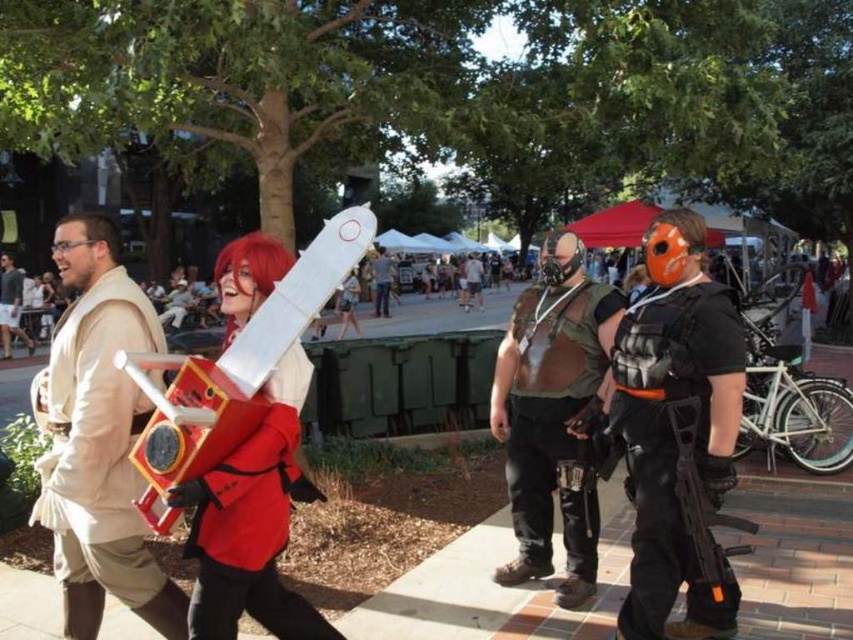
Is beige fabric coat at left further to camera compared to leather vest at center?

No, it is not.

From the picture: Does beige fabric coat at left lie in front of leather vest at center?

Yes.

Who is more forward, (x=132, y=476) or (x=553, y=342)?

Point (x=132, y=476) is more forward.

Locate an element on the screen. beige fabric coat at left is located at coordinates (97, 440).

Does beige fabric coat at left appear on the left side of matte black vest at center?

In fact, beige fabric coat at left is to the right of matte black vest at center.

Does beige fabric coat at left appear under matte black vest at center?

Yes, beige fabric coat at left is below matte black vest at center.

Between point (67, 504) and point (383, 300), which one is positioned in front?

Point (67, 504) is more forward.

Locate an element on the screen. Image resolution: width=853 pixels, height=640 pixels. beige fabric coat at left is located at coordinates pyautogui.click(x=97, y=440).

The image size is (853, 640). I want to click on red fabric jacket at center, so click(252, 522).

Is point (231, 481) positioned before point (375, 276)?

Yes, it is.

Is point (192, 480) positioned before point (389, 260)?

Yes, it is in front of point (389, 260).

This screenshot has height=640, width=853. Find the location of `red fabric jacket at center`. red fabric jacket at center is located at coordinates [x=252, y=522].